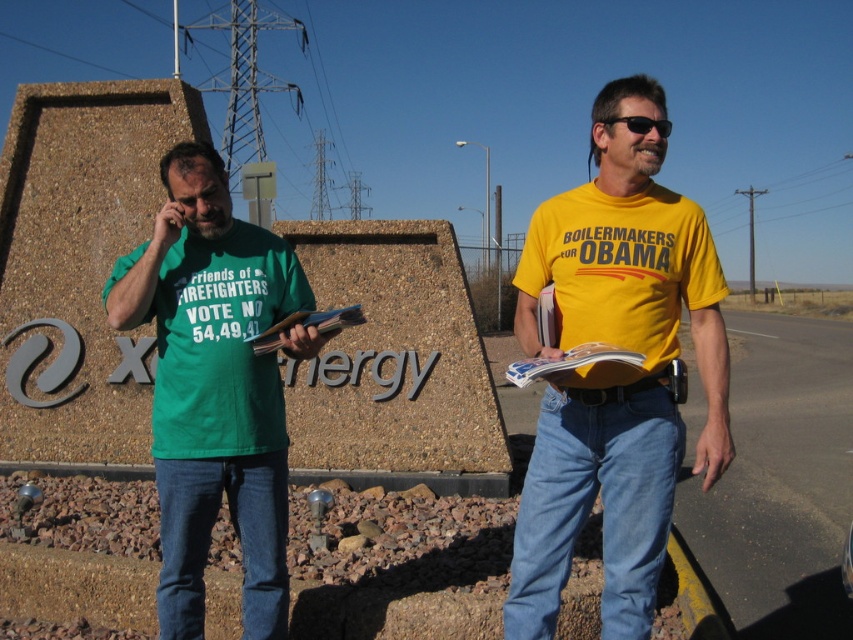
Question: Is green t-shirt at left positioned before black plastic sunglasses at center?

Choices:
 (A) yes
 (B) no

Answer: (B)

Question: Estimate the real-world distances between objects in this image. Which object is farther from the black plastic sunglasses at center?

Choices:
 (A) yellow t-shirt at center
 (B) green t-shirt at left

Answer: (B)

Question: Is yellow t-shirt at center positioned behind green t-shirt at left?

Choices:
 (A) no
 (B) yes

Answer: (A)

Question: Which object is closer to the camera taking this photo?

Choices:
 (A) yellow t-shirt at center
 (B) black plastic sunglasses at center
 (C) green t-shirt at left

Answer: (A)

Question: Is yellow t-shirt at center to the right of green t-shirt at left from the viewer's perspective?

Choices:
 (A) no
 (B) yes

Answer: (B)

Question: Which point is farther to the camera?

Choices:
 (A) yellow t-shirt at center
 (B) black plastic sunglasses at center
 (C) green t-shirt at left

Answer: (C)